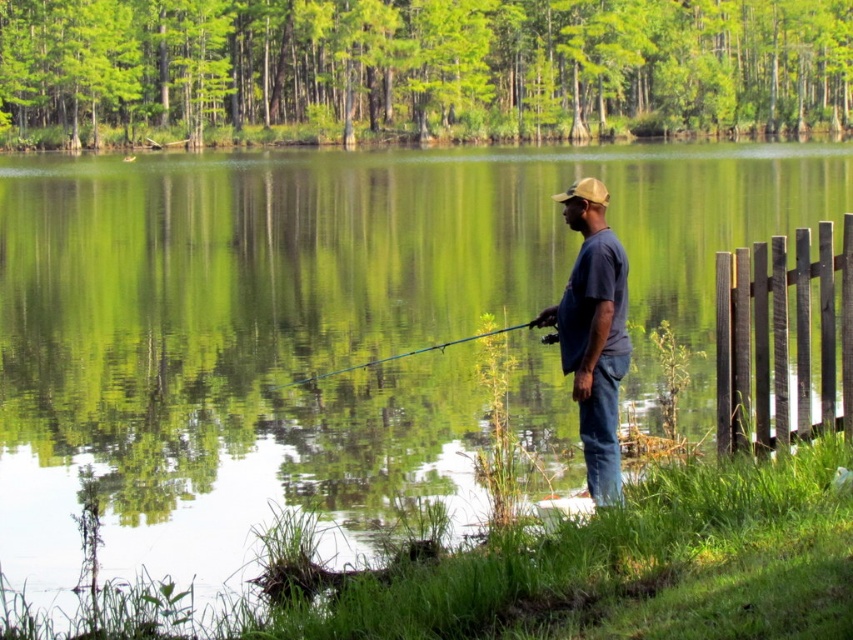
Question: Does blue cotton shirt at center have a larger size compared to teal fiberglass rod at center?

Choices:
 (A) yes
 (B) no

Answer: (B)

Question: Which object appears closest to the camera in this image?

Choices:
 (A) brown wooden fence at right
 (B) blue cotton shirt at center

Answer: (B)

Question: Among these objects, which one is farthest from the camera?

Choices:
 (A) brown wooden fence at right
 (B) blue cotton shirt at center

Answer: (A)

Question: Observing the image, what is the correct spatial positioning of brown wooden fence at right in reference to blue cotton shirt at center?

Choices:
 (A) below
 (B) above

Answer: (B)

Question: Which object is closer to the camera taking this photo?

Choices:
 (A) brown wooden fence at right
 (B) blue cotton shirt at center

Answer: (B)

Question: Can you confirm if blue cotton shirt at center is wider than teal fiberglass rod at center?

Choices:
 (A) yes
 (B) no

Answer: (B)